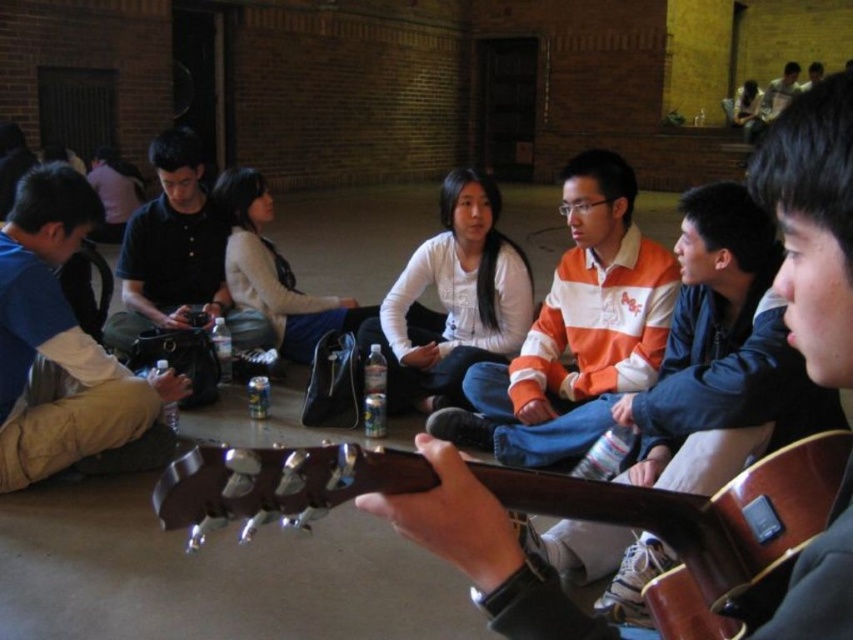
Which is more to the right, brown wood guitar at center or matte black shirt at upper right?

From the viewer's perspective, matte black shirt at upper right appears more on the right side.

Does brown wood guitar at center have a greater width compared to matte black shirt at upper right?

→ No.

Find the location of a particular element. The width and height of the screenshot is (853, 640). brown wood guitar at center is located at coordinates (704, 529).

You are a GUI agent. You are given a task and a screenshot of the screen. Output one action in this format:
    pyautogui.click(x=<x>, y=<y>)
    Task: Click on the brown wood guitar at center
    The height and width of the screenshot is (640, 853).
    Given the screenshot: What is the action you would take?
    pyautogui.click(x=704, y=529)

Is brown wood guitar at center smaller than black matte shirt at center?

Correct, brown wood guitar at center occupies less space than black matte shirt at center.

Where is `brown wood guitar at center`? This screenshot has height=640, width=853. brown wood guitar at center is located at coordinates (704, 529).

Where is `brown wood guitar at center`? brown wood guitar at center is located at coordinates (704, 529).

Is white striped sweater at center positioned at the back of white matte shirt at center?

No, it is not.

Can you confirm if white striped sweater at center is positioned above white matte shirt at center?

No.

Which is in front, point (448, 428) or point (386, 308)?

Point (448, 428) is in front.

Locate an element on the screen. white striped sweater at center is located at coordinates (575, 332).